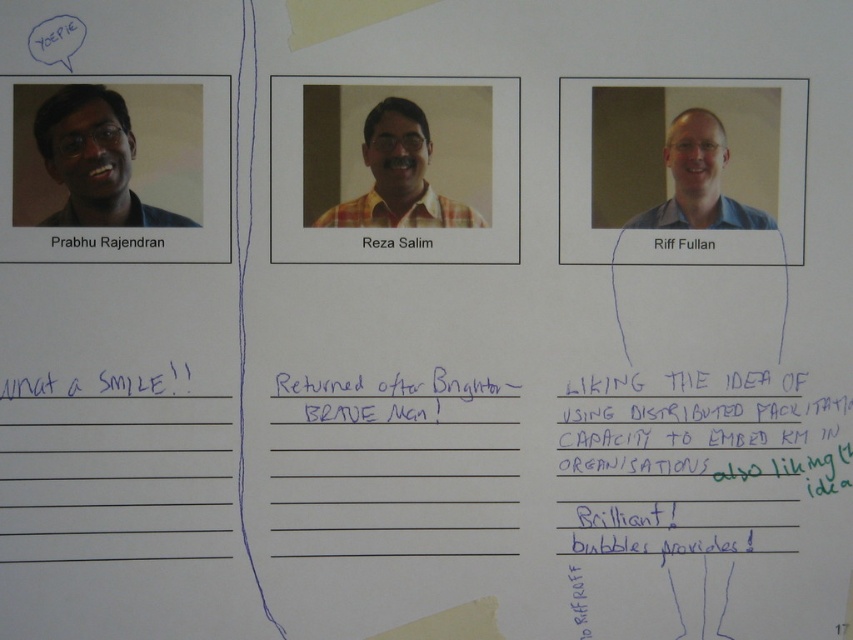
Who is more forward, (x=163, y=224) or (x=712, y=179)?

Point (x=163, y=224)

Is matte black face at left thinner than blue shirt at center?

No.

Is point (102, 100) closer to camera compared to point (693, 173)?

Yes.

This screenshot has width=853, height=640. What are the coordinates of `matte black face at left` in the screenshot? It's located at (93, 160).

Is point (51, 168) less distant than point (309, 406)?

Yes, it is.

Is matte black face at left above black ink writing at center?

Yes.

What do you see at coordinates (93, 160) in the screenshot? I see `matte black face at left` at bounding box center [93, 160].

You are a GUI agent. You are given a task and a screenshot of the screen. Output one action in this format:
    pyautogui.click(x=<x>, y=<y>)
    Task: Click on the matte black face at left
    
    Given the screenshot: What is the action you would take?
    pyautogui.click(x=93, y=160)

Does matte black face at left have a lesser height compared to yellow plaid shirt at center?

No, matte black face at left is not shorter than yellow plaid shirt at center.

Is point (45, 156) more distant than point (405, 166)?

No, it is in front of (405, 166).

Locate an element on the screen. The width and height of the screenshot is (853, 640). matte black face at left is located at coordinates (93, 160).

Locate an element on the screen. matte black face at left is located at coordinates (93, 160).